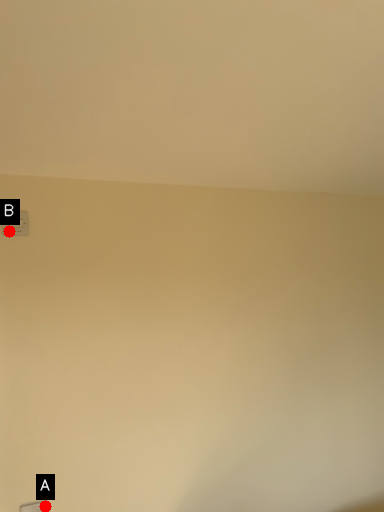
Question: Two points are circled on the image, labeled by A and B beside each circle. Which point is closer to the camera?

Choices:
 (A) A is closer
 (B) B is closer

Answer: (A)